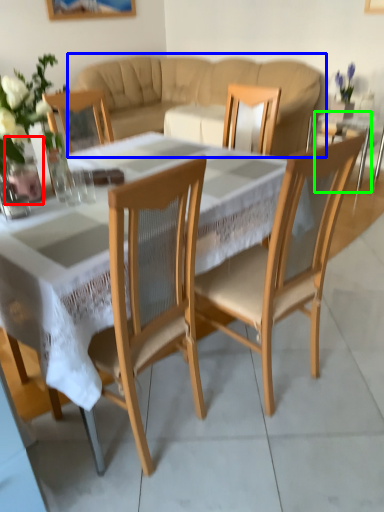
Question: Which object is positioned farthest from glass vase (highlighted by a red box)? Select from studio couch (highlighted by a blue box) and side table (highlighted by a green box).

Choices:
 (A) studio couch
 (B) side table

Answer: (A)